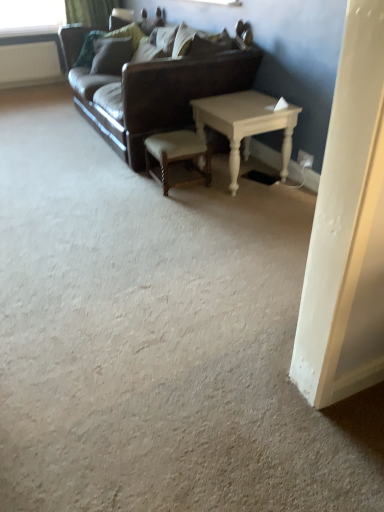
Question: Is white wood table at center outside leather couch at center?

Choices:
 (A) yes
 (B) no

Answer: (A)

Question: Considering the relative sizes of white wood table at center and leather couch at center in the image provided, is white wood table at center thinner than leather couch at center?

Choices:
 (A) yes
 (B) no

Answer: (A)

Question: Considering the relative sizes of white wood table at center and leather couch at center in the image provided, is white wood table at center smaller than leather couch at center?

Choices:
 (A) yes
 (B) no

Answer: (A)

Question: Can you confirm if white wood table at center is positioned to the right of leather couch at center?

Choices:
 (A) no
 (B) yes

Answer: (B)

Question: From a real-world perspective, is white wood table at center over leather couch at center?

Choices:
 (A) yes
 (B) no

Answer: (B)

Question: Is green fabric curtain at upper left to the left or to the right of white wood table at center in the image?

Choices:
 (A) right
 (B) left

Answer: (B)

Question: In terms of size, does green fabric curtain at upper left appear bigger or smaller than white wood table at center?

Choices:
 (A) small
 (B) big

Answer: (A)

Question: Relative to white wood table at center, is green fabric curtain at upper left in front or behind?

Choices:
 (A) behind
 (B) front

Answer: (A)

Question: Considering the positions of green fabric curtain at upper left and white wood table at center in the image, is green fabric curtain at upper left taller or shorter than white wood table at center?

Choices:
 (A) tall
 (B) short

Answer: (B)

Question: Considering their positions, is white wood table at center located in front of or behind suede-like beige pillow at upper center, acting as the first pillow starting from the right?

Choices:
 (A) behind
 (B) front

Answer: (B)

Question: From the image's perspective, is white wood table at center positioned above or below suede-like beige pillow at upper center, acting as the first pillow starting from the right?

Choices:
 (A) below
 (B) above

Answer: (A)

Question: In the image, is white wood table at center on the left side or the right side of suede-like beige pillow at upper center, which is the 2th pillow from left to right?

Choices:
 (A) right
 (B) left

Answer: (A)

Question: Is white wood table at center bigger or smaller than suede-like beige pillow at upper center, acting as the second pillow starting from the back?

Choices:
 (A) big
 (B) small

Answer: (A)

Question: Is white plastic radiator at upper left bigger or smaller than velvet green pillow at upper center, the 2th pillow from the right?

Choices:
 (A) small
 (B) big

Answer: (A)

Question: Based on their positions, is white plastic radiator at upper left located to the left or right of velvet green pillow at upper center, the 2th pillow from the right?

Choices:
 (A) right
 (B) left

Answer: (B)